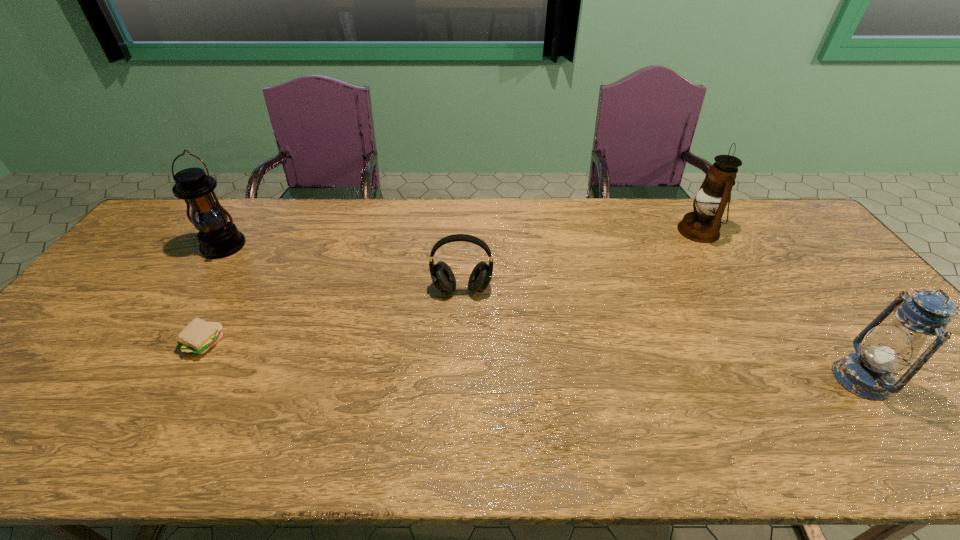
Where is `free space located on the side of the second lantern from left to right, there is a wick adjustment knob`? Image resolution: width=960 pixels, height=540 pixels. free space located on the side of the second lantern from left to right, there is a wick adjustment knob is located at coordinates (633, 231).

Locate an element on the screen. This screenshot has height=540, width=960. free space located 0.110m on the front-facing side of the nearest lantern is located at coordinates (789, 379).

You are a GUI agent. You are given a task and a screenshot of the screen. Output one action in this format:
    pyautogui.click(x=<x>, y=<y>)
    Task: Click on the free region located on the front-facing side of the nearest lantern
    Image resolution: width=960 pixels, height=540 pixels.
    Given the screenshot: What is the action you would take?
    pyautogui.click(x=679, y=379)

You are a GUI agent. You are given a task and a screenshot of the screen. Output one action in this format:
    pyautogui.click(x=<x>, y=<y>)
    Task: Click on the free location located 0.240m on the front-facing side of the nearest lantern
    This screenshot has height=540, width=960.
    Given the screenshot: What is the action you would take?
    pyautogui.click(x=734, y=379)

Where is `free space located on the ear cups of the fourth tallest object`? The image size is (960, 540). free space located on the ear cups of the fourth tallest object is located at coordinates (458, 390).

You are a GUI agent. You are given a task and a screenshot of the screen. Output one action in this format:
    pyautogui.click(x=<x>, y=<y>)
    Task: Click on the free region located on the back of the shortest object
    This screenshot has height=540, width=960.
    Given the screenshot: What is the action you would take?
    pyautogui.click(x=222, y=309)

Image resolution: width=960 pixels, height=540 pixels. Find the location of `object that is at the right edge`. object that is at the right edge is located at coordinates [x=868, y=373].

I want to click on free space at the far edge of the desktop, so click(x=576, y=198).

What are the coordinates of `vacant area at the near edge` in the screenshot? It's located at (319, 441).

Find the location of a particular element. This screenshot has height=540, width=960. vacant space at the left edge of the desktop is located at coordinates (162, 256).